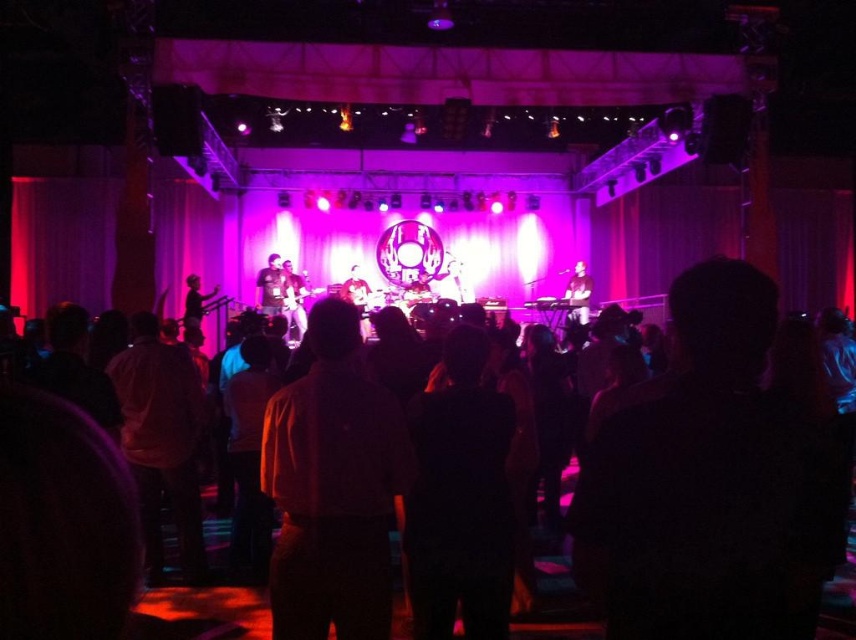
Is orange shirt at center to the right of dark brown shirt at center from the viewer's perspective?

Incorrect, orange shirt at center is not on the right side of dark brown shirt at center.

Is orange shirt at center wider than dark brown shirt at center?

Indeed, orange shirt at center has a greater width compared to dark brown shirt at center.

What are the coordinates of `orange shirt at center` in the screenshot? It's located at (333, 486).